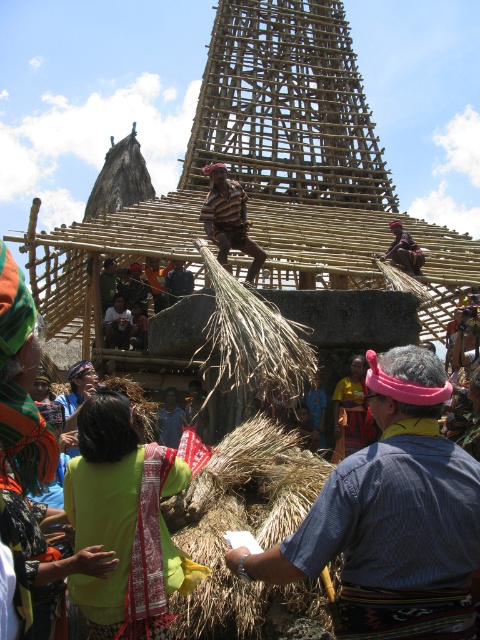
Question: Does green woven cloth at center have a larger size compared to striped fabric man at center?

Choices:
 (A) no
 (B) yes

Answer: (B)

Question: Estimate the real-world distances between objects in this image. Which object is farther from the bamboo structure at center?

Choices:
 (A) dry straw at center
 (B) striped fabric man at center
 (C) blue fabric at center
 (D) dark blue shirt at center

Answer: (C)

Question: Which of these objects is positioned farthest from the pink fabric headband at center?

Choices:
 (A) striped fabric man at center
 (B) green woven cloth at center

Answer: (A)

Question: Can you confirm if pink fabric headband at center is smaller than yellow fabric at center?

Choices:
 (A) yes
 (B) no

Answer: (B)

Question: Observing the image, what is the correct spatial positioning of matte black shirt at center in reference to blue fabric at center?

Choices:
 (A) left
 (B) right

Answer: (A)

Question: Among these points, which one is nearest to the camera?

Choices:
 (A) (168, 403)
 (B) (84, 520)
 (C) (213, 168)

Answer: (B)